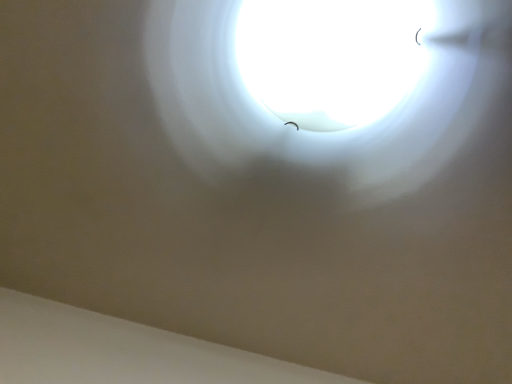
Measure the distance between point (279, 55) and camera.

27.60 inches.

This screenshot has width=512, height=384. Describe the element at coordinates (330, 57) in the screenshot. I see `white glossy light bulb at upper center` at that location.

What are the coordinates of `white glossy light bulb at upper center` in the screenshot? It's located at (330, 57).

What is the approximate width of white glossy light bulb at upper center?

It is 10.91 inches.

The width and height of the screenshot is (512, 384). What are the coordinates of `white glossy light bulb at upper center` in the screenshot? It's located at (330, 57).